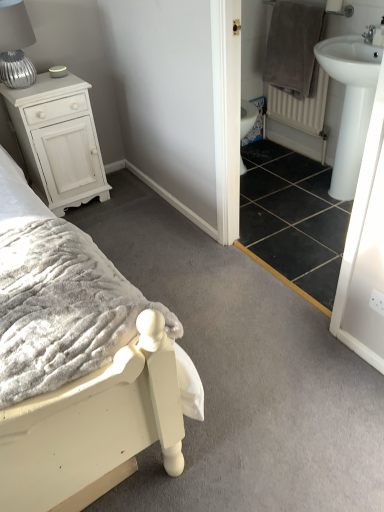
Question: Is white textured radiator at right facing towards silver ribbed table lamp at left?

Choices:
 (A) yes
 (B) no

Answer: (A)

Question: From the image's perspective, is white textured radiator at right below silver ribbed table lamp at left?

Choices:
 (A) yes
 (B) no

Answer: (A)

Question: Considering the relative positions of white textured radiator at right and silver ribbed table lamp at left in the image provided, is white textured radiator at right to the left of silver ribbed table lamp at left from the viewer's perspective?

Choices:
 (A) no
 (B) yes

Answer: (A)

Question: Is white textured radiator at right positioned in front of silver ribbed table lamp at left?

Choices:
 (A) no
 (B) yes

Answer: (A)

Question: Is white textured radiator at right further to the viewer compared to silver ribbed table lamp at left?

Choices:
 (A) no
 (B) yes

Answer: (B)

Question: Would you say white glossy sink at right is to the left or to the right of gray plush towel at upper right in the picture?

Choices:
 (A) left
 (B) right

Answer: (B)

Question: In terms of width, does white glossy sink at right look wider or thinner when compared to gray plush towel at upper right?

Choices:
 (A) wide
 (B) thin

Answer: (A)

Question: Would you say white glossy sink at right is inside or outside gray plush towel at upper right?

Choices:
 (A) outside
 (B) inside

Answer: (A)

Question: Is white glossy sink at right taller or shorter than gray plush towel at upper right?

Choices:
 (A) tall
 (B) short

Answer: (A)

Question: In the image, is gray plush towel at upper right on the left side or the right side of white textured radiator at right?

Choices:
 (A) right
 (B) left

Answer: (B)

Question: Is gray plush towel at upper right wider or thinner than white textured radiator at right?

Choices:
 (A) wide
 (B) thin

Answer: (A)

Question: In the image, is gray plush towel at upper right positioned in front of or behind white textured radiator at right?

Choices:
 (A) behind
 (B) front

Answer: (B)

Question: From the image's perspective, is gray plush towel at upper right positioned above or below white textured radiator at right?

Choices:
 (A) below
 (B) above

Answer: (B)

Question: Is white painted wood chest of drawers at upper left taller or shorter than white glossy sink at right?

Choices:
 (A) short
 (B) tall

Answer: (A)

Question: Is white painted wood chest of drawers at upper left inside or outside of white glossy sink at right?

Choices:
 (A) inside
 (B) outside

Answer: (B)